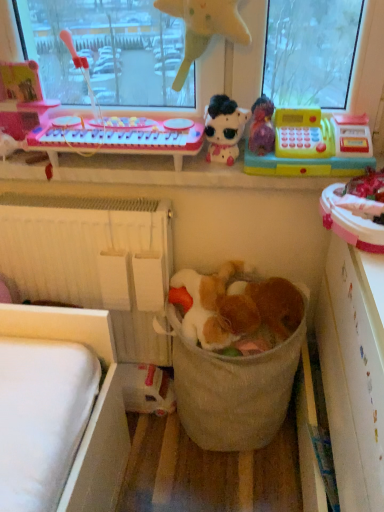
What is the approximate height of pink plastic keyboard at upper left?

4.27 inches.

Identify the location of white matte plush toy at upper center, the third toy ordered from the bottom. (224, 128).

Measure the distance between white plastic shelf at right and camera.

white plastic shelf at right is 26.80 inches away from camera.

Find the location of a particular element. Image resolution: width=384 pixels, height=512 pixels. shiny plastic toy piano at upper left, the 4th toy positioned from the bottom is located at coordinates (21, 98).

Describe the element at coordinates (21, 98) in the screenshot. I see `shiny plastic toy piano at upper left, which is counted as the 2th toy, starting from the top` at that location.

You are a GUI agent. You are given a task and a screenshot of the screen. Output one action in this format:
    pyautogui.click(x=<x>, y=<y>)
    Task: Click on the pink plastic keyboard at upper left
    The image size is (384, 512).
    Given the screenshot: What is the action you would take?
    pyautogui.click(x=120, y=137)

Is shiny plastic toy piano at upper left, which is the 1th toy in left-to-right order, smaller than white matte plush toy at upper center, the third toy ordered from the bottom?

No.

Who is more distant, shiny plastic toy piano at upper left, which is counted as the 2th toy, starting from the top, or white matte plush toy at upper center, which is the third toy in right-to-left order?

shiny plastic toy piano at upper left, which is counted as the 2th toy, starting from the top, is further from the camera.

From a real-world perspective, who is located lower, shiny plastic toy piano at upper left, which is the 5th toy in right-to-left order, or white matte plush toy at upper center, which is the 3th toy from left to right?

From a 3D spatial view, white matte plush toy at upper center, which is the 3th toy from left to right, is below.

From the image's perspective, does shiny plastic toy piano at upper left, which is the 1th toy in left-to-right order, appear lower than white matte plush toy at upper center, which is the 3th toy from left to right?

No, from the image's perspective, shiny plastic toy piano at upper left, which is the 1th toy in left-to-right order, is not below white matte plush toy at upper center, which is the 3th toy from left to right.

Is white textured radiator at lower left in front of or behind yellow plastic cash register at upper right, which is the fifth toy in left-to-right order, in the image?

Clearly, white textured radiator at lower left is behind yellow plastic cash register at upper right, which is the fifth toy in left-to-right order.

Consider the image. From a real-world perspective, does white textured radiator at lower left stand above yellow plastic cash register at upper right, which appears as the first toy when viewed from the right?

No.

Looking at this image, considering the relative sizes of white textured radiator at lower left and yellow plastic cash register at upper right, the fourth toy from the top, in the image provided, is white textured radiator at lower left smaller than yellow plastic cash register at upper right, the fourth toy from the top,?

No, white textured radiator at lower left is not smaller than yellow plastic cash register at upper right, the fourth toy from the top.

Is there a large distance between yellow plush star at upper center, the 2th toy in the left-to-right sequence, and white matte plush toy at upper center, the third toy ordered from the bottom?

yellow plush star at upper center, the 2th toy in the left-to-right sequence, is near white matte plush toy at upper center, the third toy ordered from the bottom, not far away.

Which of these two, yellow plush star at upper center, which is counted as the 4th toy, starting from the right, or white matte plush toy at upper center, which is the third toy in right-to-left order, stands taller?

With more height is yellow plush star at upper center, which is counted as the 4th toy, starting from the right.

Which object is positioned more to the right, yellow plush star at upper center, which is counted as the 4th toy, starting from the right, or white matte plush toy at upper center, arranged as the third toy when viewed from the top?

From the viewer's perspective, white matte plush toy at upper center, arranged as the third toy when viewed from the top, appears more on the right side.

From the image's perspective, which is below, yellow plush star at upper center, the 2th toy in the left-to-right sequence, or white matte plush toy at upper center, arranged as the third toy when viewed from the top?

white matte plush toy at upper center, arranged as the third toy when viewed from the top, from the image's perspective.

From the image's perspective, is fuzzy fabric stuffed animal at center, which appears as the first toy when ordered from the bottom, above shiny plastic toy piano at upper left, which is counted as the 2th toy, starting from the top?

Actually, fuzzy fabric stuffed animal at center, which appears as the first toy when ordered from the bottom, appears below shiny plastic toy piano at upper left, which is counted as the 2th toy, starting from the top, in the image.

Is fuzzy fabric stuffed animal at center, positioned as the 4th toy in left-to-right order, inside the boundaries of shiny plastic toy piano at upper left, the 4th toy positioned from the bottom, or outside?

fuzzy fabric stuffed animal at center, positioned as the 4th toy in left-to-right order, is located beyond the bounds of shiny plastic toy piano at upper left, the 4th toy positioned from the bottom.

Is fuzzy fabric stuffed animal at center, which is the 2th toy in right-to-left order, to the left of shiny plastic toy piano at upper left, which is the 5th toy in right-to-left order, from the viewer's perspective?

No, fuzzy fabric stuffed animal at center, which is the 2th toy in right-to-left order, is not to the left of shiny plastic toy piano at upper left, which is the 5th toy in right-to-left order.

Considering the relative sizes of fuzzy fabric stuffed animal at center, which appears as the first toy when ordered from the bottom, and shiny plastic toy piano at upper left, which is counted as the 2th toy, starting from the top, in the image provided, is fuzzy fabric stuffed animal at center, which appears as the first toy when ordered from the bottom, shorter than shiny plastic toy piano at upper left, which is counted as the 2th toy, starting from the top,?

Yes.

From the image's perspective, which is below, yellow plastic cash register at upper right, which appears as the first toy when viewed from the right, or white plastic shelf at right?

white plastic shelf at right.

Is yellow plastic cash register at upper right, the fourth toy from the top, aimed at white plastic shelf at right?

No.

Between yellow plastic cash register at upper right, which appears as the first toy when viewed from the right, and white plastic shelf at right, which one has less height?

yellow plastic cash register at upper right, which appears as the first toy when viewed from the right.

Is the position of white matte plush toy at upper center, the third toy ordered from the bottom, less distant than that of white plastic shelf at right?

No, the depth of white matte plush toy at upper center, the third toy ordered from the bottom, is greater than that of white plastic shelf at right.

How many degrees apart are the facing directions of white matte plush toy at upper center, which is the 3th toy from left to right, and white plastic shelf at right?

The facing directions of white matte plush toy at upper center, which is the 3th toy from left to right, and white plastic shelf at right are 90.1 degrees apart.

Is white matte plush toy at upper center, the third toy ordered from the bottom, to the right of white plastic shelf at right from the viewer's perspective?

No, white matte plush toy at upper center, the third toy ordered from the bottom, is not to the right of white plastic shelf at right.

From a real-world perspective, is white matte plush toy at upper center, the third toy ordered from the bottom, physically located above or below white plastic shelf at right?

Clearly, from a real-world perspective, white matte plush toy at upper center, the third toy ordered from the bottom, is above white plastic shelf at right.

In the scene shown: Could you measure the distance between shiny plastic toy piano at upper left, which is the 5th toy in right-to-left order, and white textured radiator at lower left?

A distance of 16.51 inches exists between shiny plastic toy piano at upper left, which is the 5th toy in right-to-left order, and white textured radiator at lower left.

This screenshot has height=512, width=384. Identify the location of the 4th toy above the white textured radiator at lower left (from a real-world perspective). (21, 98).

Can you tell me how much shiny plastic toy piano at upper left, which is the 5th toy in right-to-left order, and white textured radiator at lower left differ in facing direction?

shiny plastic toy piano at upper left, which is the 5th toy in right-to-left order, and white textured radiator at lower left are facing 2.59 degrees away from each other.

Between shiny plastic toy piano at upper left, which is the 1th toy in left-to-right order, and white textured radiator at lower left, which one has larger width?

white textured radiator at lower left.

Image resolution: width=384 pixels, height=512 pixels. I want to click on the 1st toy in front when counting from the shiny plastic toy piano at upper left, which is the 5th toy in right-to-left order, so click(x=224, y=128).

This screenshot has height=512, width=384. Find the location of `radiator behind the yellow plastic cash register at upper right, the fourth toy from the top`. radiator behind the yellow plastic cash register at upper right, the fourth toy from the top is located at coordinates (94, 260).

Which object lies further to the anchor point yellow plastic cash register at upper right, which appears as the first toy when viewed from the right, beige fabric laundry basket at center or fuzzy fabric stuffed animal at center, positioned as the 4th toy in left-to-right order?

beige fabric laundry basket at center lies further to yellow plastic cash register at upper right, which appears as the first toy when viewed from the right, than the other object.

Estimate the real-world distances between objects in this image. Which object is closer to white matte plush toy at upper center, which is the third toy in right-to-left order, yellow plastic cash register at upper right, the fourth toy from the top, or white plastic shelf at right?

Among the two, yellow plastic cash register at upper right, the fourth toy from the top, is located nearer to white matte plush toy at upper center, which is the third toy in right-to-left order.

Which object lies nearer to the anchor point shiny plastic toy piano at upper left, the 4th toy positioned from the bottom, white matte plush toy at upper center, the third toy ordered from the bottom, or white plastic shelf at right?

white matte plush toy at upper center, the third toy ordered from the bottom.

When comparing their distances from yellow plastic cash register at upper right, which is the 2th toy in bottom-to-top order, does beige fabric laundry basket at center or white plastic shelf at right seem further?

beige fabric laundry basket at center.

Looking at the image, which one is located closer to shiny plastic toy piano at upper left, which is the 1th toy in left-to-right order, beige fabric laundry basket at center or yellow plush star at upper center, which appears as the fifth toy when ordered from the bottom?

yellow plush star at upper center, which appears as the fifth toy when ordered from the bottom.

Considering their positions, is white matte plush toy at upper center, the third toy ordered from the bottom, positioned closer to pink plastic keyboard at upper left than white textured radiator at lower left?

white matte plush toy at upper center, the third toy ordered from the bottom, is positioned closer to the anchor pink plastic keyboard at upper left.

Based on their spatial positions, is beige fabric laundry basket at center or fuzzy fabric stuffed animal at center, positioned as the 4th toy in left-to-right order, further from pink plastic keyboard at upper left?

beige fabric laundry basket at center is further to pink plastic keyboard at upper left.

Which object lies further to the anchor point shiny plastic toy piano at upper left, which is the 1th toy in left-to-right order, white textured radiator at lower left or pink plastic keyboard at upper left?

white textured radiator at lower left is further to shiny plastic toy piano at upper left, which is the 1th toy in left-to-right order.

The image size is (384, 512). I want to click on toy between yellow plastic cash register at upper right, which is the 2th toy in bottom-to-top order, and beige fabric laundry basket at center in the up-down direction, so click(x=236, y=307).

Where is `radiator between shiny plastic toy piano at upper left, the 4th toy positioned from the bottom, and yellow plastic cash register at upper right, which is the 2th toy in bottom-to-top order`? radiator between shiny plastic toy piano at upper left, the 4th toy positioned from the bottom, and yellow plastic cash register at upper right, which is the 2th toy in bottom-to-top order is located at coordinates (94, 260).

Identify the location of changing table between yellow plush star at upper center, the 2th toy in the left-to-right sequence, and beige fabric laundry basket at center in the up-down direction. The width and height of the screenshot is (384, 512). (120, 137).

Find the location of a particular element. changing table between white matte plush toy at upper center, which is the third toy in right-to-left order, and white plastic shelf at right, in the vertical direction is located at coordinates (120, 137).